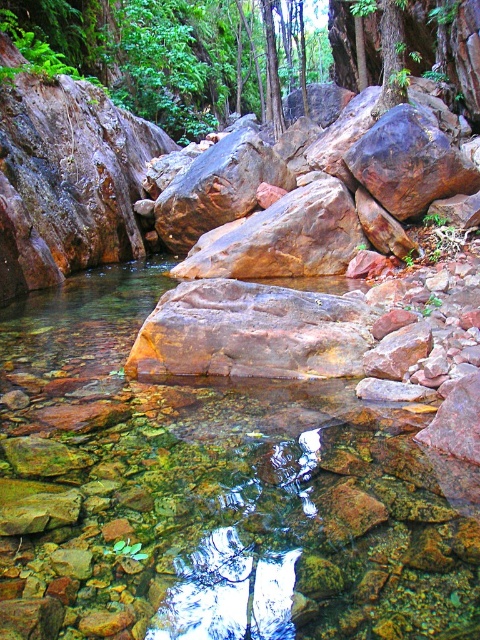
Question: Where is clear glass stream at center located in relation to rustic brown rock at center in the image?

Choices:
 (A) right
 (B) left

Answer: (A)

Question: Can you confirm if brown/rough rock at center is bigger than rustic brown rock at center?

Choices:
 (A) no
 (B) yes

Answer: (A)

Question: Which object is positioned farthest from the rustic brown rock at center?

Choices:
 (A) clear glass stream at center
 (B) brown/rough rock at center

Answer: (A)

Question: Is clear glass stream at center bigger than rustic brown rock at center?

Choices:
 (A) yes
 (B) no

Answer: (B)

Question: Estimate the real-world distances between objects in this image. Which object is farther from the brown/rough rock at center?

Choices:
 (A) rustic brown rock at center
 (B) clear glass stream at center

Answer: (A)

Question: Which is farther from the clear glass stream at center?

Choices:
 (A) brown/rough rock at center
 (B) rustic brown rock at center

Answer: (B)